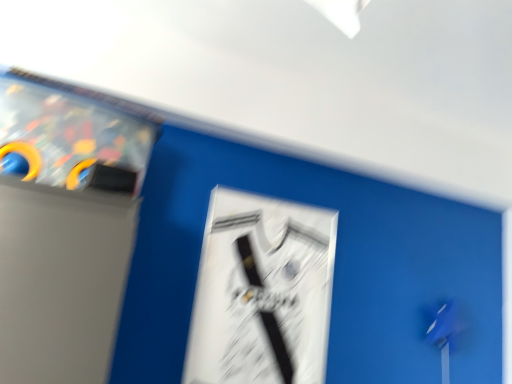
Question: Should I look upward or downward to see white glossy poster at center?

Choices:
 (A) up
 (B) down

Answer: (B)